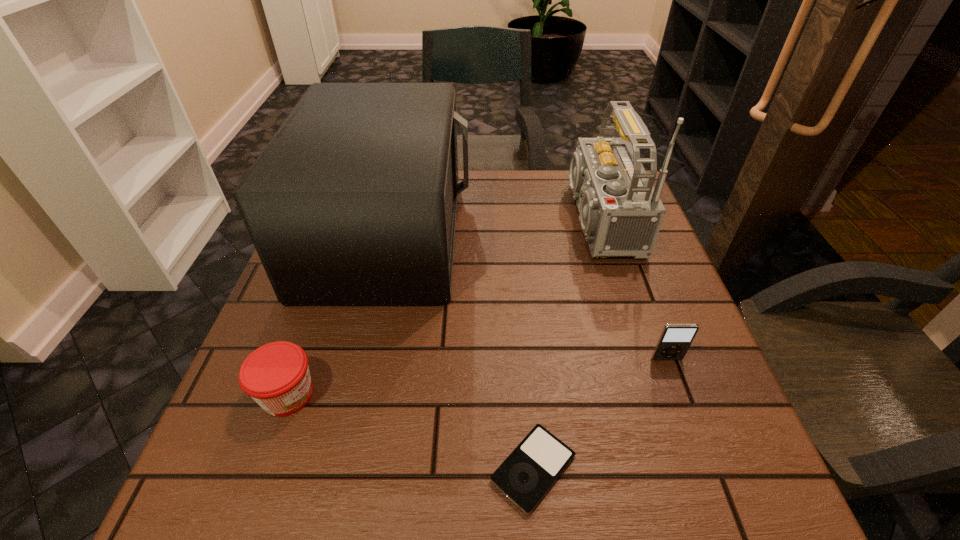
At what (x,y) coordinates should I click in order to perform the action: click on vacant space that satisfies the following two spatial constraints: 1. on the label side of the shortest object; 2. on the left side of the fourth farthest object. Please return your answer as a coordinate pair (x, y). The width and height of the screenshot is (960, 540). Looking at the image, I should click on (262, 468).

Identify the location of vacant space that satisfies the following two spatial constraints: 1. on the label side of the jam; 2. on the back side of the nearest object. (262, 468).